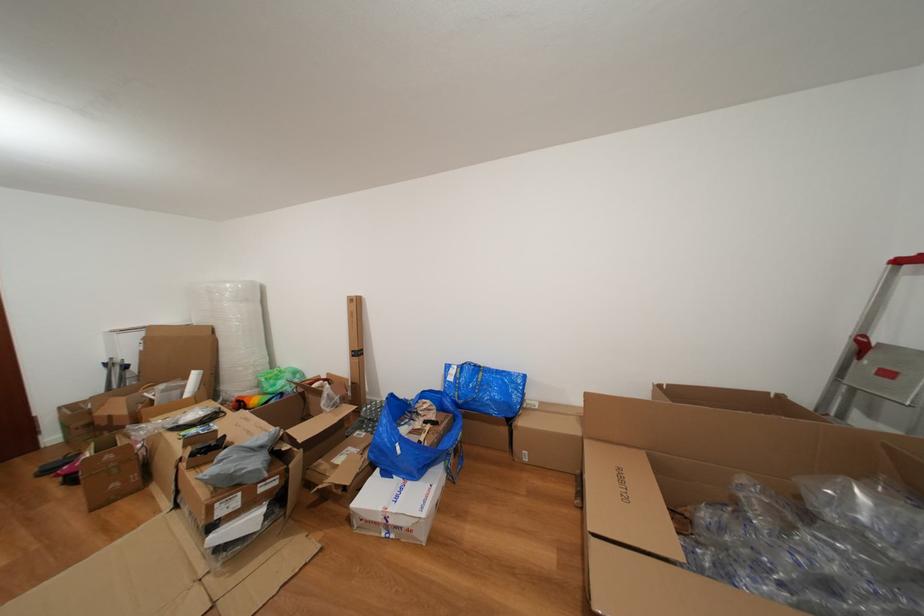
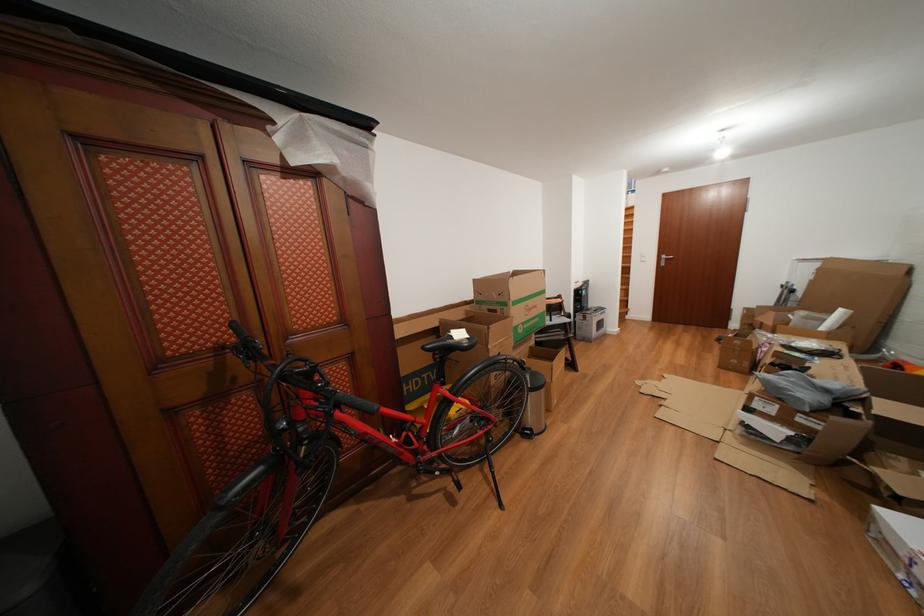
In the scene shown: Based on the continuous images, in which direction is the camera rotating?

The camera rotated toward left-down.